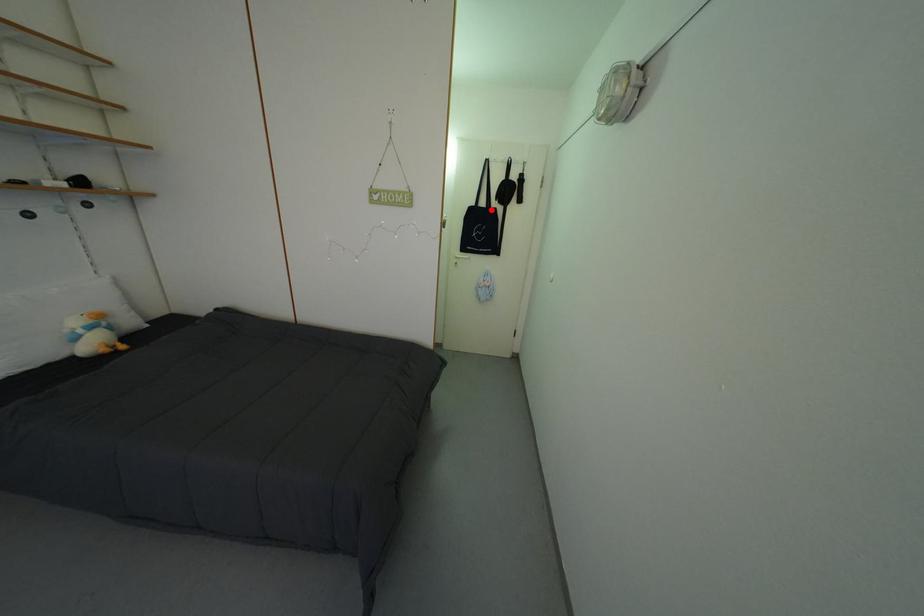
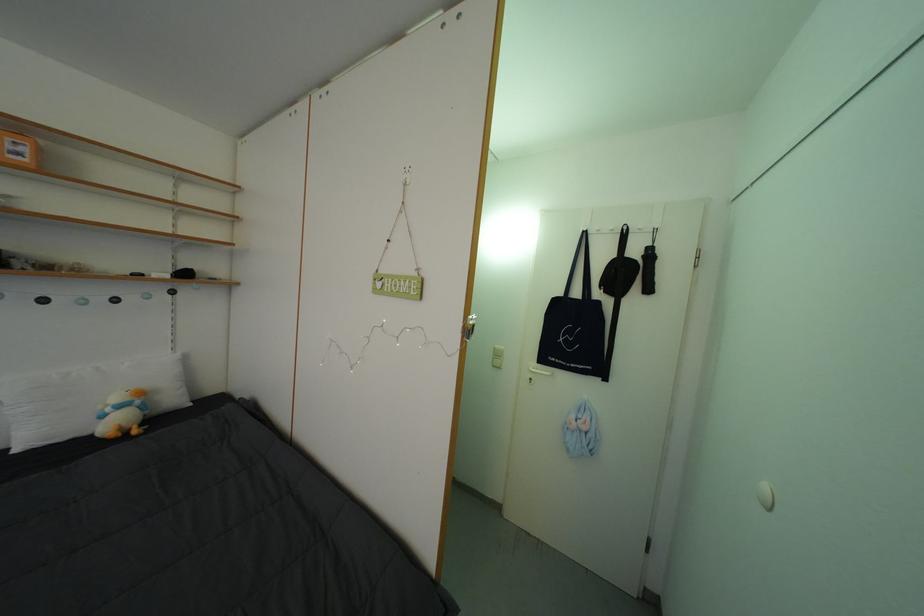
In the second image, find the point that corresponds to the highlighted location in the first image.

(586, 300)